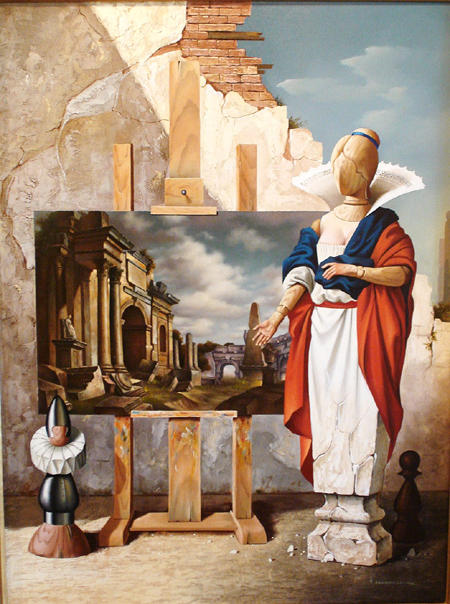
The width and height of the screenshot is (450, 604). Find the location of `statue`. statue is located at coordinates (57, 501).